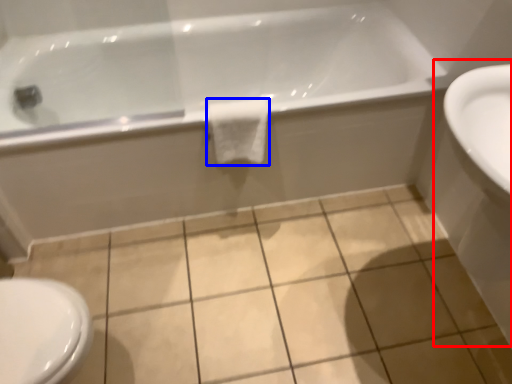
Question: Which object appears farthest to the camera in this image, sink (highlighted by a red box) or bath towel (highlighted by a blue box)?

Choices:
 (A) sink
 (B) bath towel

Answer: (B)